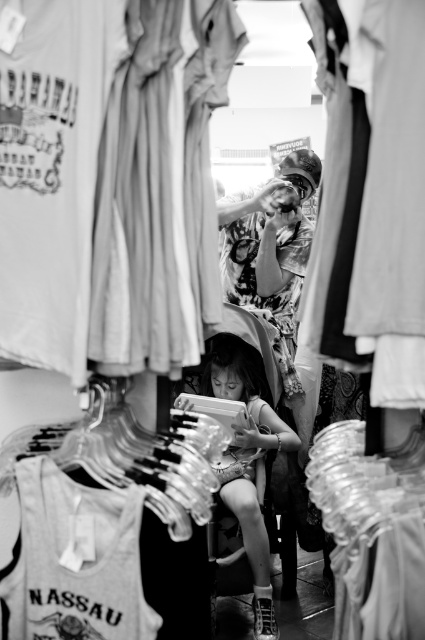
Question: Among these objects, which one is nearest to the camera?

Choices:
 (A) smooth skin child at center
 (B) matte white blouse at center
 (C) printed fabric shirt at center

Answer: (B)

Question: Which point is closer to the camera?

Choices:
 (A) (139, 572)
 (B) (229, 493)
 (C) (243, 300)

Answer: (A)

Question: Can you confirm if matte white blouse at center is bigger than white cotton tank top at lower left?

Choices:
 (A) yes
 (B) no

Answer: (A)

Question: Does white cotton tank top at lower left come in front of smooth skin child at center?

Choices:
 (A) yes
 (B) no

Answer: (A)

Question: Is smooth skin child at center below printed fabric shirt at center?

Choices:
 (A) yes
 (B) no

Answer: (A)

Question: Based on their relative distances, which object is farther from the printed fabric shirt at center?

Choices:
 (A) smooth skin child at center
 (B) matte white blouse at center
 (C) white cotton tank top at lower left

Answer: (C)